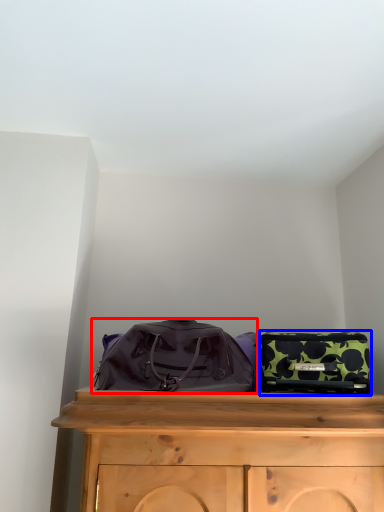
Question: Which object is further to the camera taking this photo, luggage and bags (highlighted by a red box) or luggage and bags (highlighted by a blue box)?

Choices:
 (A) luggage and bags
 (B) luggage and bags

Answer: (B)